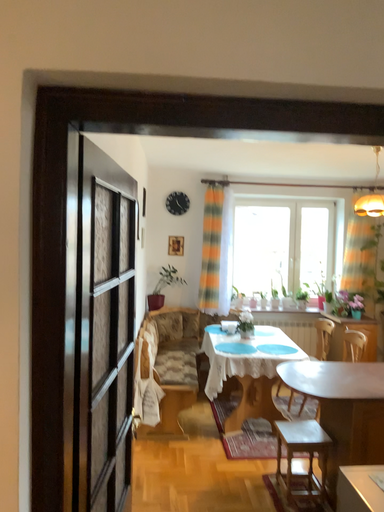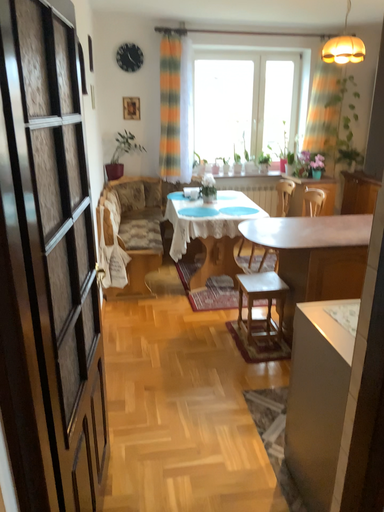
Question: How did the camera likely rotate when shooting the video?

Choices:
 (A) rotated upward
 (B) rotated downward

Answer: (B)